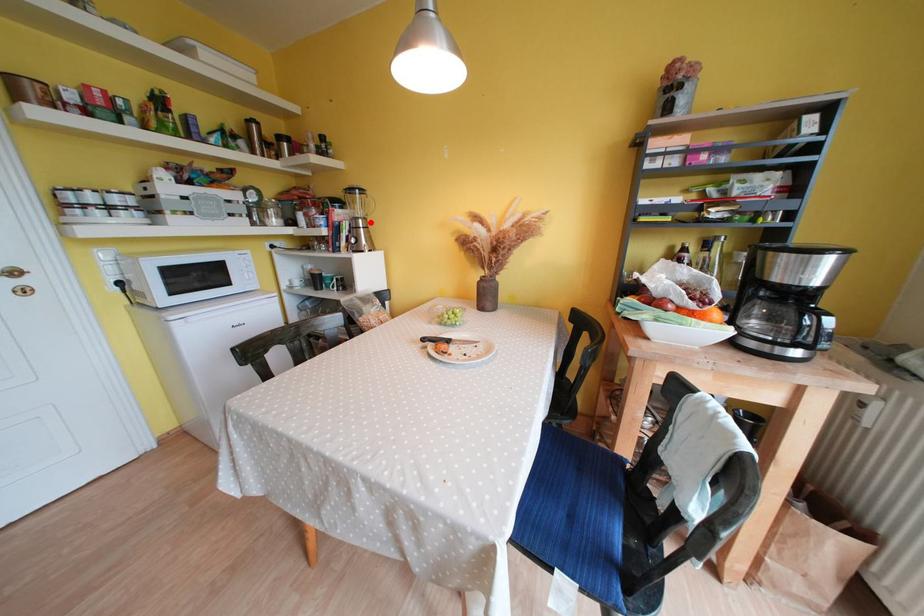
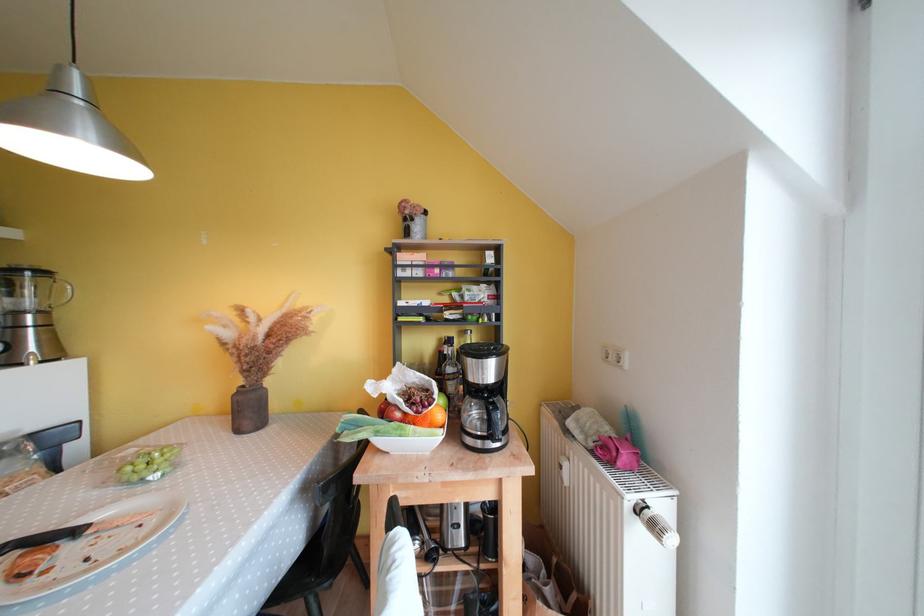
Question: I am providing you with two images of the same scene from different viewpoints. Given a red point in image1, look at the same physical point in image2. Is it:

Choices:
 (A) Closer to the viewpoint
 (B) Farther from the viewpoint

Answer: (B)